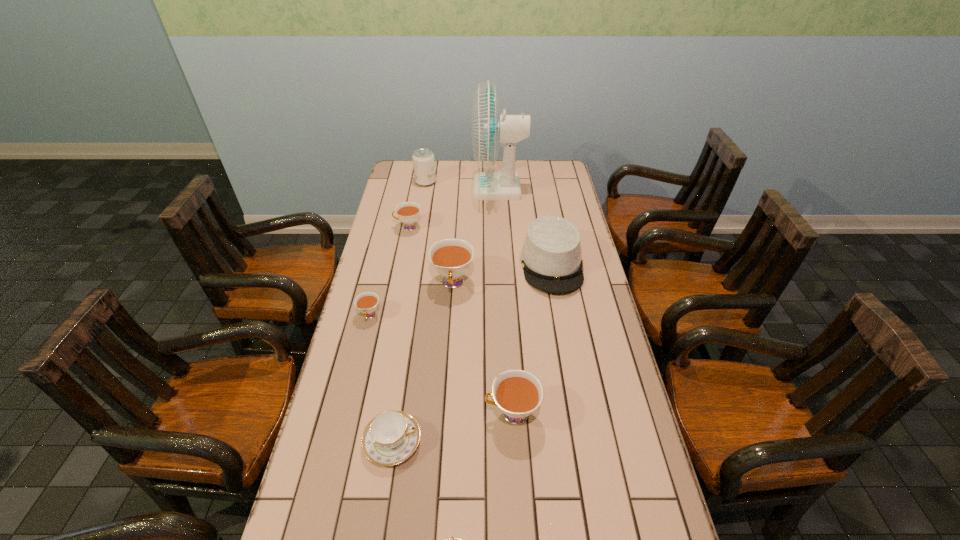
I want to click on the tallest object, so click(x=488, y=128).

Find the location of a particular element. fan is located at coordinates (488, 128).

I want to click on soda can, so click(423, 159).

Where is `the biggest white teacup`? The image size is (960, 540). the biggest white teacup is located at coordinates (451, 258).

This screenshot has width=960, height=540. I want to click on the tallest teacup, so tap(451, 258).

Where is `hat`? The height and width of the screenshot is (540, 960). hat is located at coordinates (551, 255).

The width and height of the screenshot is (960, 540). Identify the location of the rightmost white teacup. (518, 393).

The image size is (960, 540). Find the location of `the rightmost teacup`. the rightmost teacup is located at coordinates (518, 393).

At what (x,y) coordinates should I click in order to perform the action: click on the farthest teacup. Please return your answer as a coordinate pair (x, y). This screenshot has width=960, height=540. Looking at the image, I should click on (408, 213).

Where is `the third farthest object`? This screenshot has width=960, height=540. the third farthest object is located at coordinates (408, 213).